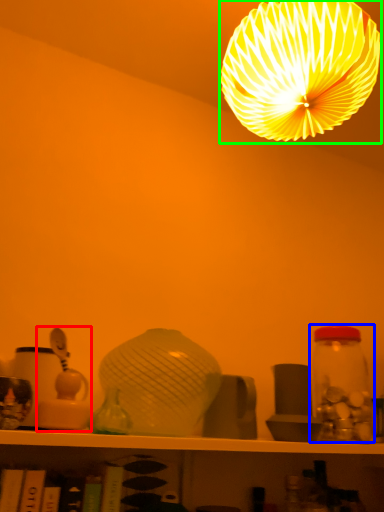
Question: Estimate the real-world distances between objects in this image. Which object is farther from toy (highlighted by a red box), glass jar (highlighted by a blue box) or lamp (highlighted by a green box)?

Choices:
 (A) glass jar
 (B) lamp

Answer: (B)